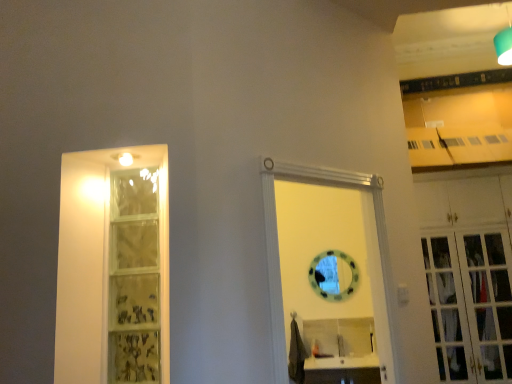
Question: Does white wooden door at center have a greater height compared to matte glass shelf at left?

Choices:
 (A) yes
 (B) no

Answer: (A)

Question: Is white wooden door at center positioned with its back to matte glass shelf at left?

Choices:
 (A) yes
 (B) no

Answer: (B)

Question: Is white wooden door at center at the right side of matte glass shelf at left?

Choices:
 (A) yes
 (B) no

Answer: (A)

Question: Is white wooden door at center far away from matte glass shelf at left?

Choices:
 (A) yes
 (B) no

Answer: (B)

Question: Is white wooden door at center aimed at matte glass shelf at left?

Choices:
 (A) yes
 (B) no

Answer: (B)

Question: From a real-world perspective, relative to white wood cabinet at right, is white wooden door at center vertically above or below?

Choices:
 (A) below
 (B) above

Answer: (B)

Question: Is white wooden door at center bigger or smaller than white wood cabinet at right?

Choices:
 (A) big
 (B) small

Answer: (B)

Question: Looking at their shapes, would you say white wooden door at center is wider or thinner than white wood cabinet at right?

Choices:
 (A) thin
 (B) wide

Answer: (A)

Question: Is white wooden door at center taller or shorter than white wood cabinet at right?

Choices:
 (A) tall
 (B) short

Answer: (B)

Question: From a real-world perspective, is matte glass shelf at left physically located above or below white wooden door at center?

Choices:
 (A) below
 (B) above

Answer: (B)

Question: In terms of height, does matte glass shelf at left look taller or shorter compared to white wooden door at center?

Choices:
 (A) short
 (B) tall

Answer: (A)

Question: In the image, is matte glass shelf at left positioned in front of or behind white wooden door at center?

Choices:
 (A) behind
 (B) front

Answer: (A)

Question: Considering the positions of point (117, 225) and point (269, 261), is point (117, 225) closer or farther from the camera than point (269, 261)?

Choices:
 (A) farther
 (B) closer

Answer: (A)

Question: Do you think matte glass shelf at left is within white wood cabinet at right, or outside of it?

Choices:
 (A) outside
 (B) inside

Answer: (A)

Question: From a real-world perspective, relative to white wood cabinet at right, is matte glass shelf at left vertically above or below?

Choices:
 (A) below
 (B) above

Answer: (B)